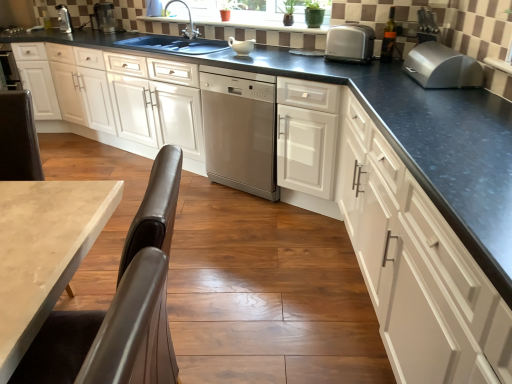
You are a GUI agent. You are given a task and a screenshot of the screen. Output one action in this format:
    pyautogui.click(x=<x>, y=<y>)
    Task: Click on the free space in front of white glossy cabinet at center, acting as the second cabinetry starting from the right
    
    Given the screenshot: What is the action you would take?
    [300, 241]